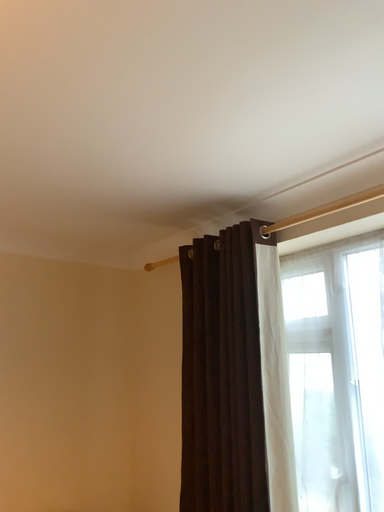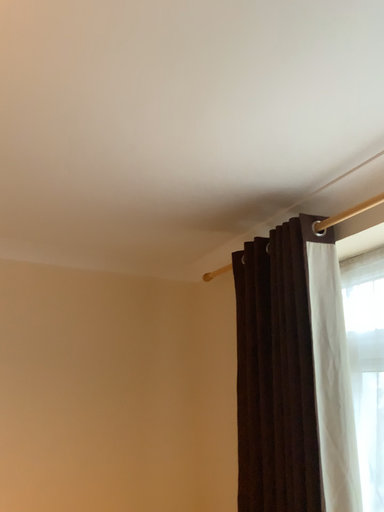
Question: Which way did the camera rotate in the video?

Choices:
 (A) rotated right
 (B) rotated left

Answer: (B)